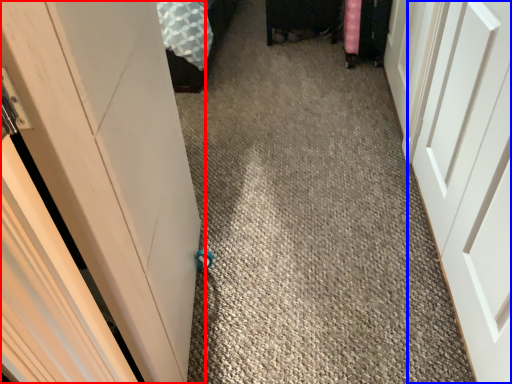
Question: Among these objects, which one is farthest to the camera, door (highlighted by a red box) or door (highlighted by a blue box)?

Choices:
 (A) door
 (B) door

Answer: (B)